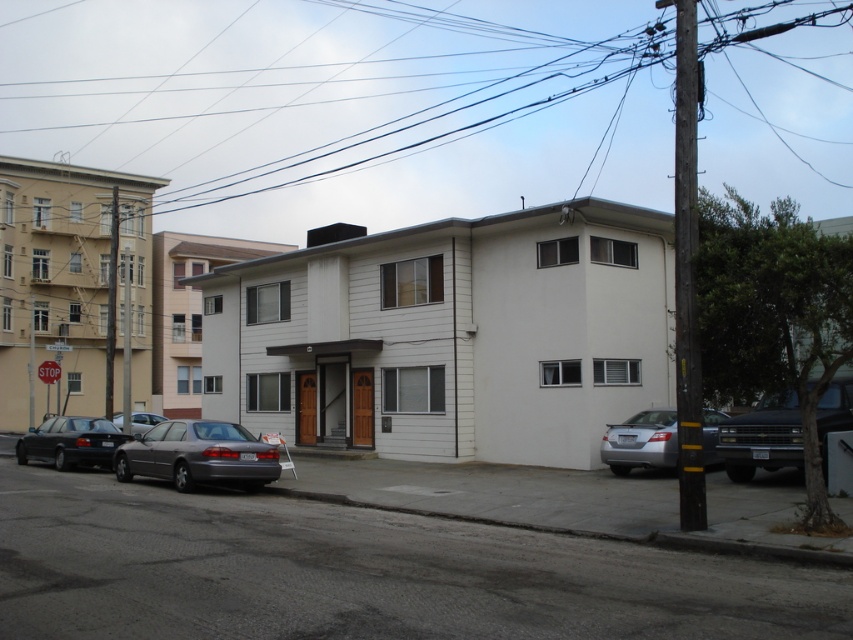
Question: Is satin silver sedan at lower left bigger than shiny black sedan at left?

Choices:
 (A) no
 (B) yes

Answer: (A)

Question: Which of the following is the closest to the observer?

Choices:
 (A) (132, 426)
 (B) (277, 176)
 (C) (761, 461)

Answer: (C)

Question: Can you confirm if silver metallic sedan at lower right is positioned to the right of shiny black sedan at left?

Choices:
 (A) no
 (B) yes

Answer: (B)

Question: Estimate the real-world distances between objects in this image. Which object is farther from the black wire at upper center?

Choices:
 (A) satin silver sedan at lower left
 (B) silver metallic sedan at lower left
 (C) shiny black sedan at left

Answer: (A)

Question: Which of the following is the farthest from the observer?

Choices:
 (A) (132, 417)
 (B) (79, 449)
 (C) (485, 106)
 (D) (195, 461)

Answer: (C)

Question: In this image, where is black wire at upper center located relative to silver metallic sedan at lower right?

Choices:
 (A) below
 (B) above

Answer: (B)